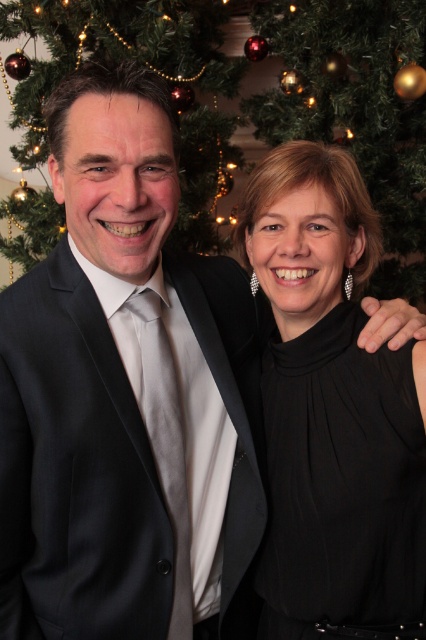
Question: Among these points, which one is farthest from the camera?

Choices:
 (A) (152, 609)
 (B) (34, 230)
 (C) (414, 480)

Answer: (B)

Question: Does black satin dress at right appear on the left side of green matte christmas tree at upper left?

Choices:
 (A) yes
 (B) no

Answer: (B)

Question: Is black satin dress at right to the left of green matte christmas tree at upper left from the viewer's perspective?

Choices:
 (A) no
 (B) yes

Answer: (A)

Question: Does dark gray suit at center appear on the right side of green matte christmas tree at upper left?

Choices:
 (A) no
 (B) yes

Answer: (B)

Question: Which object appears farthest from the camera in this image?

Choices:
 (A) dark gray suit at center
 (B) green matte christmas tree at upper left

Answer: (B)

Question: Among these points, which one is farthest from the camera?

Choices:
 (A) (365, 392)
 (B) (213, 92)

Answer: (B)